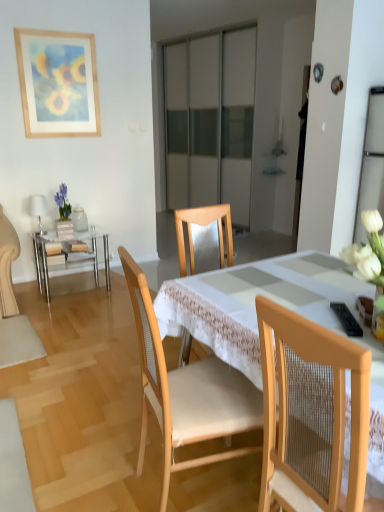
Question: Is black plastic remote control at lower right touching wooden chair at center, marked as the second chair in a right-to-left arrangement?

Choices:
 (A) no
 (B) yes

Answer: (A)

Question: Considering the relative sizes of black plastic remote control at lower right and wooden chair at center, marked as the second chair in a right-to-left arrangement, in the image provided, is black plastic remote control at lower right shorter than wooden chair at center, marked as the second chair in a right-to-left arrangement,?

Choices:
 (A) no
 (B) yes

Answer: (B)

Question: Does black plastic remote control at lower right turn towards wooden chair at center, acting as the 1th chair starting from the left?

Choices:
 (A) yes
 (B) no

Answer: (B)

Question: Can you confirm if black plastic remote control at lower right is wider than wooden chair at center, marked as the second chair in a right-to-left arrangement?

Choices:
 (A) no
 (B) yes

Answer: (A)

Question: From a real-world perspective, does black plastic remote control at lower right sit lower than wooden chair at center, acting as the 1th chair starting from the left?

Choices:
 (A) yes
 (B) no

Answer: (B)

Question: From the image's perspective, is wooden picture frame at upper left above or below clear glass table at left?

Choices:
 (A) below
 (B) above

Answer: (B)

Question: Is wooden picture frame at upper left to the left or to the right of clear glass table at left in the image?

Choices:
 (A) left
 (B) right

Answer: (A)

Question: Considering the positions of point (21, 53) and point (34, 244), is point (21, 53) closer or farther from the camera than point (34, 244)?

Choices:
 (A) closer
 (B) farther

Answer: (B)

Question: Is wooden picture frame at upper left wider or thinner than clear glass table at left?

Choices:
 (A) thin
 (B) wide

Answer: (A)

Question: From the image's perspective, is wooden picture frame at upper left located above or below wooden chair at center, acting as the 1th chair starting from the left?

Choices:
 (A) above
 (B) below

Answer: (A)

Question: Is wooden picture frame at upper left wider or thinner than wooden chair at center, marked as the second chair in a right-to-left arrangement?

Choices:
 (A) wide
 (B) thin

Answer: (B)

Question: In the image, is wooden picture frame at upper left positioned in front of or behind wooden chair at center, marked as the second chair in a right-to-left arrangement?

Choices:
 (A) front
 (B) behind

Answer: (B)

Question: Based on their positions, is wooden picture frame at upper left located to the left or right of wooden chair at center, acting as the 1th chair starting from the left?

Choices:
 (A) left
 (B) right

Answer: (A)

Question: Visually, is matte glass vase at left positioned to the left or to the right of wooden picture frame at upper left?

Choices:
 (A) left
 (B) right

Answer: (B)

Question: From the image's perspective, relative to wooden picture frame at upper left, is matte glass vase at left above or below?

Choices:
 (A) above
 (B) below

Answer: (B)